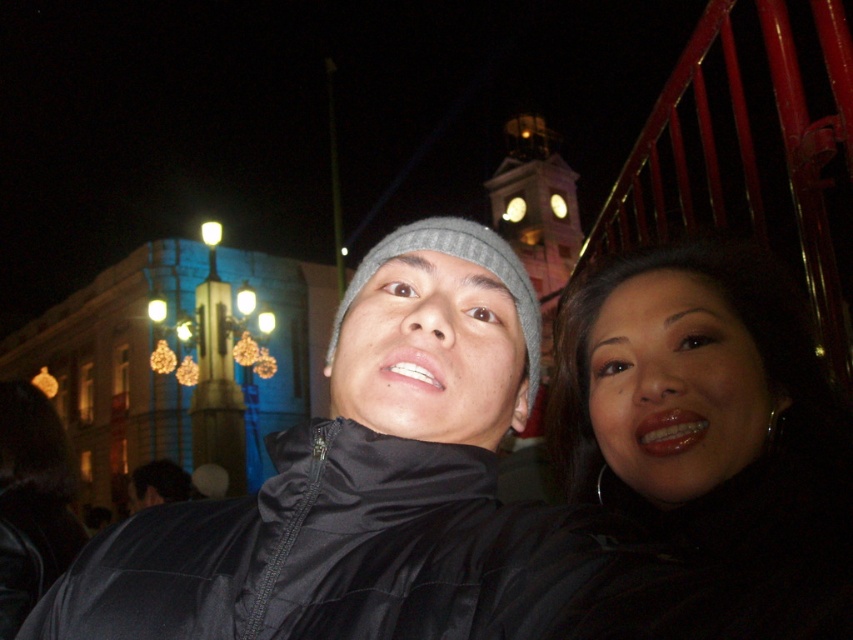
Question: Among these points, which one is nearest to the camera?

Choices:
 (A) (445, 474)
 (B) (735, 490)

Answer: (A)

Question: Can you confirm if black matte jacket at center is bigger than matte black jacket at lower right?

Choices:
 (A) yes
 (B) no

Answer: (A)

Question: Which object appears farthest from the camera in this image?

Choices:
 (A) matte black jacket at lower right
 (B) black matte jacket at center

Answer: (B)

Question: In this image, where is black matte jacket at center located relative to matte black jacket at lower right?

Choices:
 (A) right
 (B) left

Answer: (B)

Question: Among these objects, which one is farthest from the camera?

Choices:
 (A) matte black jacket at lower right
 (B) black matte jacket at center

Answer: (B)

Question: Does black matte jacket at center have a lesser width compared to matte black jacket at lower right?

Choices:
 (A) yes
 (B) no

Answer: (B)